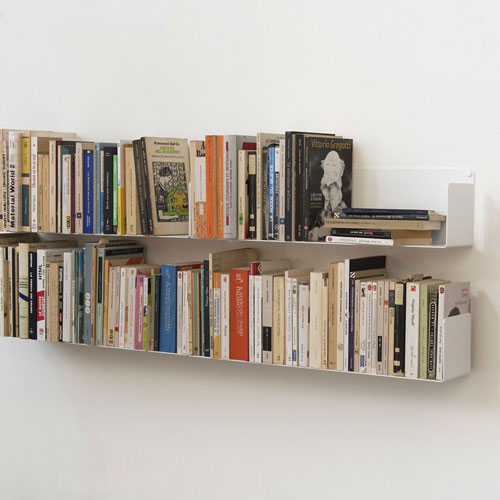
Identify the location of shelf. The height and width of the screenshot is (500, 500). (301, 368), (77, 344), (77, 234), (316, 241).